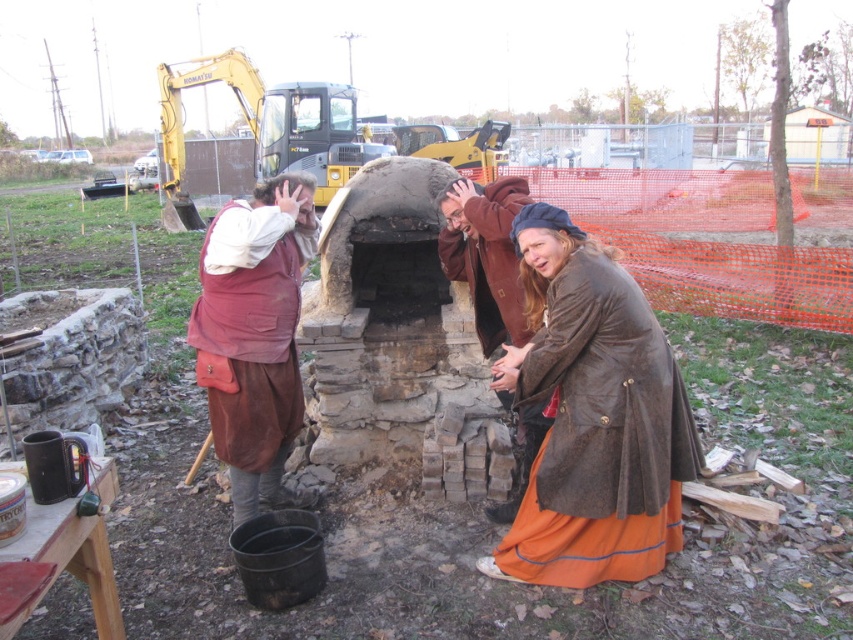
Is brown suede vest at center bigger than brown leather jacket at center?

Indeed, brown suede vest at center has a larger size compared to brown leather jacket at center.

Is brown suede vest at center below brown leather jacket at center?

Yes.

What do you see at coordinates (254, 336) in the screenshot? I see `brown suede vest at center` at bounding box center [254, 336].

Locate an element on the screen. Image resolution: width=853 pixels, height=640 pixels. brown suede vest at center is located at coordinates (254, 336).

Does brown suede coat at lower right have a lesser width compared to brown leather jacket at center?

No, brown suede coat at lower right is not thinner than brown leather jacket at center.

Between brown suede coat at lower right and brown leather jacket at center, which one appears on the right side from the viewer's perspective?

Positioned to the right is brown suede coat at lower right.

Which is in front, point (526, 253) or point (457, 228)?

Positioned in front is point (526, 253).

Find the location of a particular element. Image resolution: width=853 pixels, height=640 pixels. brown suede coat at lower right is located at coordinates (592, 417).

Is brown suede coat at lower right thinner than brown suede vest at center?

In fact, brown suede coat at lower right might be wider than brown suede vest at center.

Who is shorter, brown suede coat at lower right or brown suede vest at center?

brown suede coat at lower right is shorter.

Locate an element on the screen. The width and height of the screenshot is (853, 640). brown suede coat at lower right is located at coordinates (592, 417).